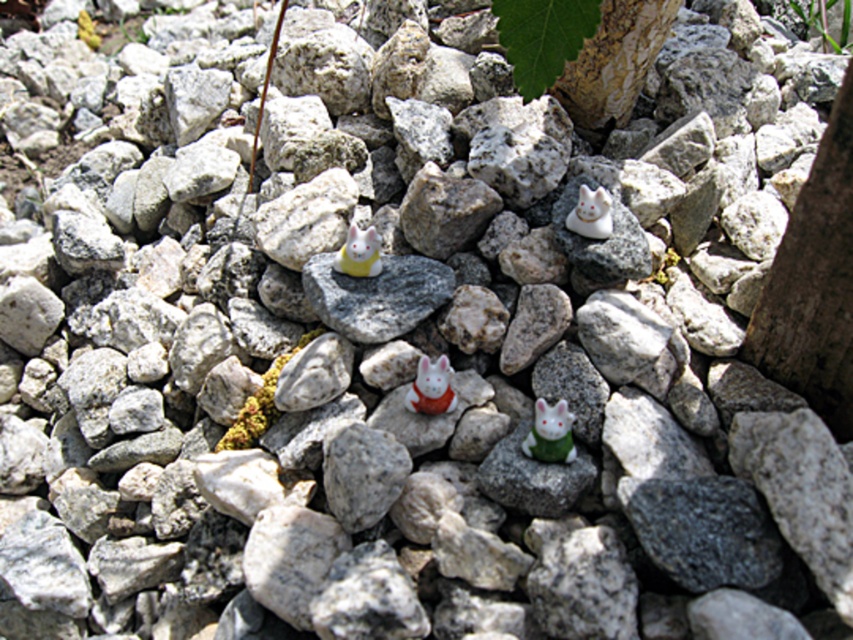
Question: Can you confirm if green leafy plant at upper center is thinner than yellow matte rabbit at center?

Choices:
 (A) yes
 (B) no

Answer: (B)

Question: Which of the following is the farthest from the observer?

Choices:
 (A) (850, 19)
 (B) (349, 232)

Answer: (A)

Question: Which point appears closest to the camera in this image?

Choices:
 (A) (433, 381)
 (B) (815, 6)

Answer: (A)

Question: Can you confirm if white glossy rabbit at center is thinner than white glossy cat at upper center?

Choices:
 (A) yes
 (B) no

Answer: (B)

Question: Among these points, which one is farthest from the camera?

Choices:
 (A) (379, 257)
 (B) (451, 369)

Answer: (A)

Question: Does green matte rabbit at center appear on the left side of green leafy plant at upper center?

Choices:
 (A) yes
 (B) no

Answer: (A)